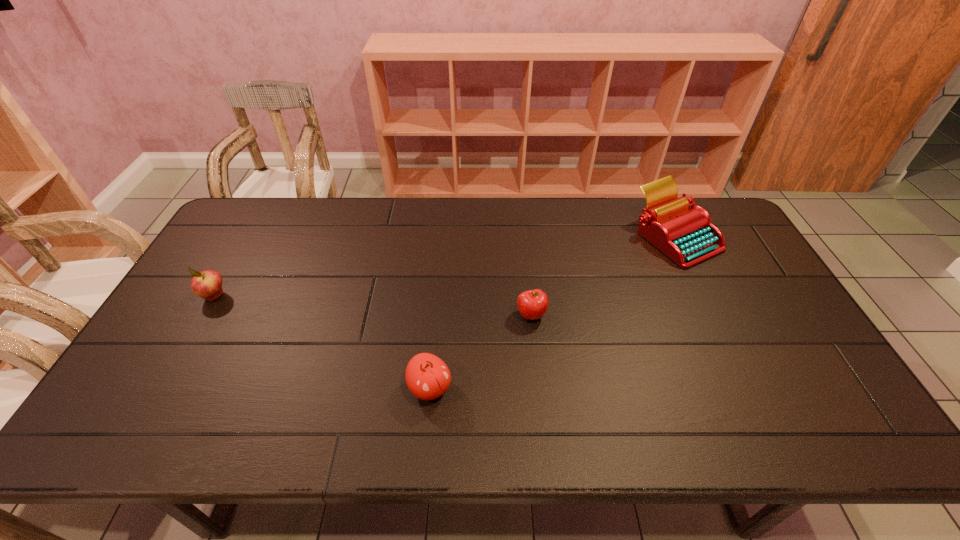
Find the location of `the tallest object`. the tallest object is located at coordinates (687, 236).

The width and height of the screenshot is (960, 540). Find the location of `the farthest object`. the farthest object is located at coordinates (687, 236).

Locate an element on the screen. This screenshot has height=540, width=960. the leftmost apple is located at coordinates (207, 284).

The image size is (960, 540). I want to click on the second object from left to right, so click(427, 376).

At what (x,y) coordinates should I click in order to perform the action: click on the nearest object. Please return your answer as a coordinate pair (x, y). Looking at the image, I should click on (427, 376).

Find the location of a particular element. Image resolution: width=960 pixels, height=540 pixels. the rightmost apple is located at coordinates (533, 304).

Image resolution: width=960 pixels, height=540 pixels. Identify the location of the shortest apple. (533, 304).

Where is `free region located on the typing side of the farthest object`? The width and height of the screenshot is (960, 540). free region located on the typing side of the farthest object is located at coordinates (732, 352).

Find the location of `vacant space situated 0.200m on the front of the leftmost apple`. vacant space situated 0.200m on the front of the leftmost apple is located at coordinates (174, 366).

Locate an element on the screen. This screenshot has height=540, width=960. vacant position located 0.050m on the right of the nearest object is located at coordinates (472, 388).